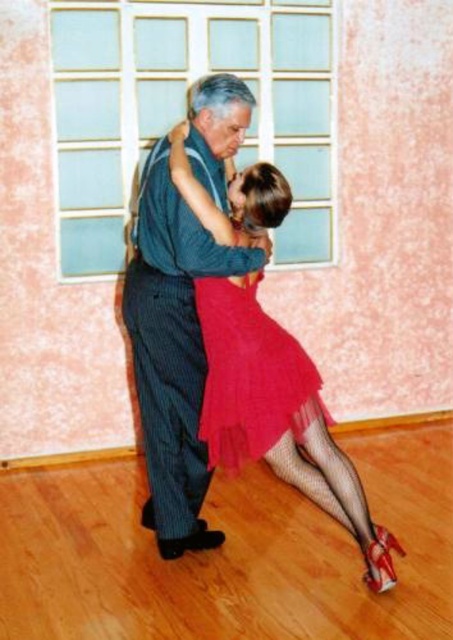
Who is taller, matte red dress at center or shiny tulle skirt at center?

matte red dress at center

The width and height of the screenshot is (453, 640). Describe the element at coordinates (174, 348) in the screenshot. I see `matte red dress at center` at that location.

This screenshot has width=453, height=640. Describe the element at coordinates (174, 348) in the screenshot. I see `matte red dress at center` at that location.

The image size is (453, 640). What are the coordinates of `matte red dress at center` in the screenshot? It's located at (174, 348).

Can you confirm if matte red dress at center is shorter than striped fabric pants at center?

Yes.

Is matte red dress at center to the left of striped fabric pants at center from the viewer's perspective?

In fact, matte red dress at center is to the right of striped fabric pants at center.

At what (x,y) coordinates should I click in order to perform the action: click on matte red dress at center. Please return your answer as a coordinate pair (x, y). Looking at the image, I should click on (174, 348).

Can you confirm if striped fabric pants at center is taller than shiny tulle skirt at center?

Indeed, striped fabric pants at center has a greater height compared to shiny tulle skirt at center.

Between point (213, 168) and point (254, 387), which one is positioned in front?

Point (254, 387) is more forward.

The width and height of the screenshot is (453, 640). I want to click on striped fabric pants at center, so [173, 349].